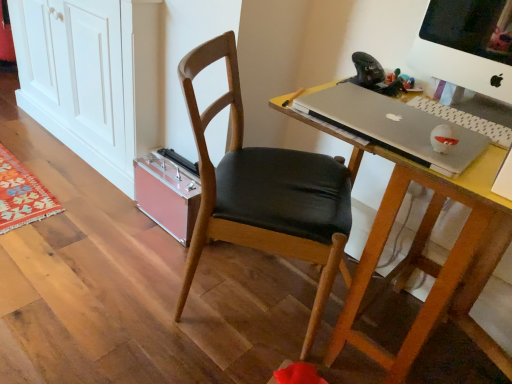
Locate an element on the screen. The height and width of the screenshot is (384, 512). blank space situated above gray matte laptop keyboard at right (from a real-world perspective) is located at coordinates (478, 122).